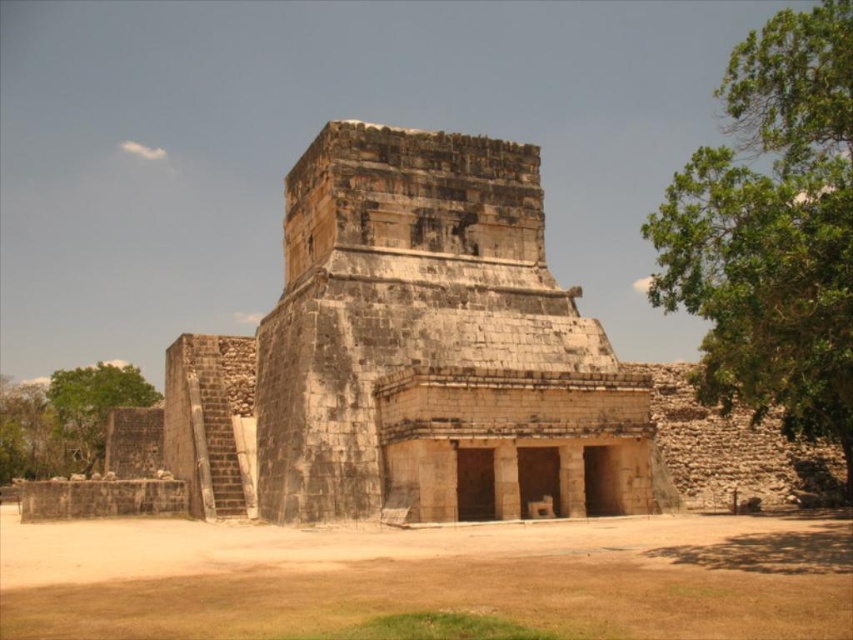
Can you confirm if stone temple at center is positioned to the right of green leafy tree at right?

In fact, stone temple at center is to the left of green leafy tree at right.

Describe the element at coordinates (416, 355) in the screenshot. I see `stone temple at center` at that location.

I want to click on stone temple at center, so coord(416,355).

From the picture: Is green leafy tree at right bigger than green leafy tree at lower left?

Yes.

Is green leafy tree at right wider than green leafy tree at lower left?

Yes.

Is point (740, 248) in front of point (73, 449)?

Yes.

The width and height of the screenshot is (853, 640). In order to click on green leafy tree at right in this screenshot , I will do `click(772, 232)`.

Does stone temple at center appear on the left side of green leafy tree at lower left?

No, stone temple at center is not to the left of green leafy tree at lower left.

Locate an element on the screen. The height and width of the screenshot is (640, 853). stone temple at center is located at coordinates (416, 355).

Locate an element on the screen. This screenshot has height=640, width=853. stone temple at center is located at coordinates (416, 355).